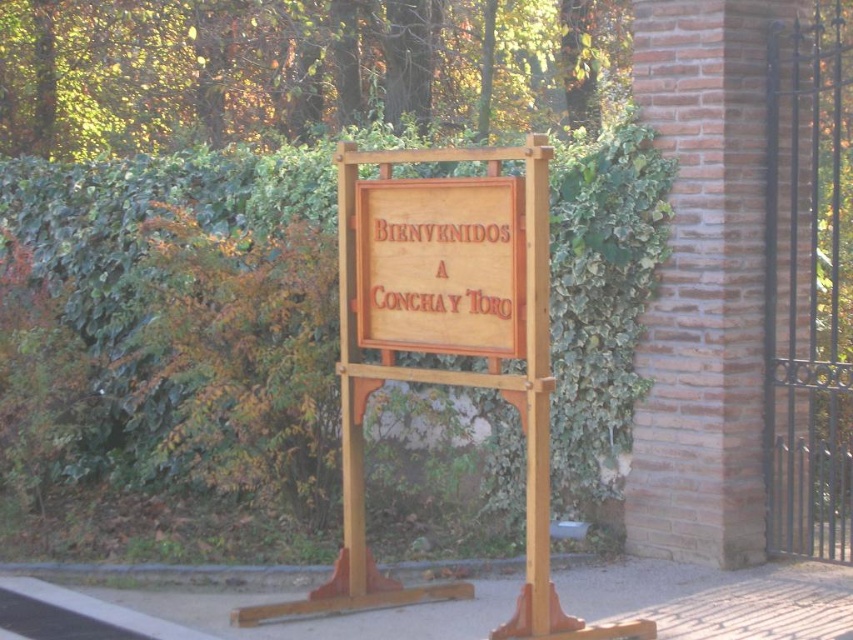
Does green ivy hedge at center appear under wooden sign at center?

Correct, green ivy hedge at center is located below wooden sign at center.

Based on the photo, does green ivy hedge at center lie in front of wooden sign at center?

No.

Who is more forward, (177, 480) or (477, 264)?

Point (477, 264)

You are a GUI agent. You are given a task and a screenshot of the screen. Output one action in this format:
    pyautogui.click(x=<x>, y=<y>)
    Task: Click on the green ivy hedge at center
    
    Given the screenshot: What is the action you would take?
    pyautogui.click(x=196, y=316)